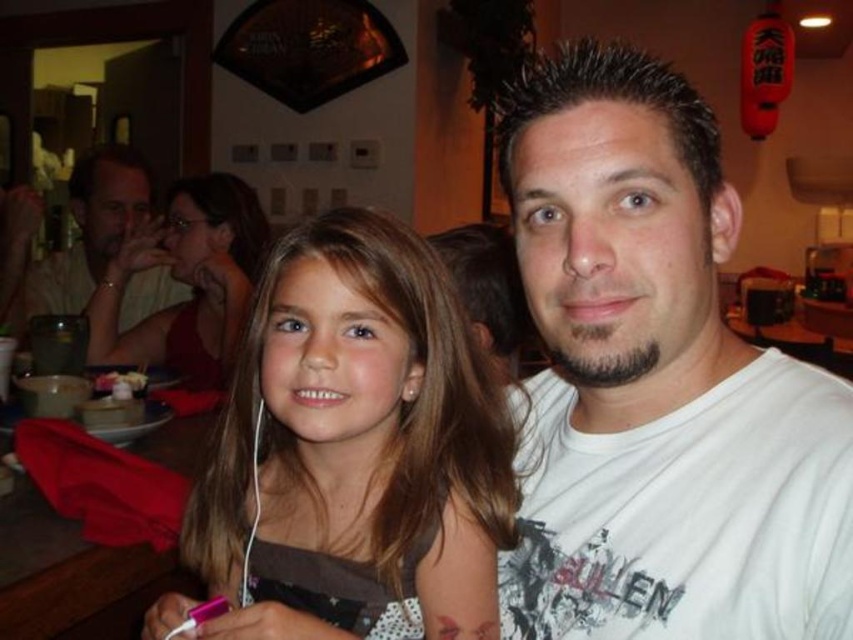
Question: Based on their relative distances, which object is nearer to the matte red dress at upper left?

Choices:
 (A) brown hair at center
 (B) matte white shirt at upper left
 (C) white cotton t-shirt at center

Answer: (B)

Question: Which object appears farthest from the camera in this image?

Choices:
 (A) matte white shirt at upper left
 (B) white cotton t-shirt at center

Answer: (A)

Question: Is white cotton t-shirt at center positioned at the back of matte white shirt at upper left?

Choices:
 (A) no
 (B) yes

Answer: (A)

Question: Is brown hair at center bigger than matte red dress at upper left?

Choices:
 (A) no
 (B) yes

Answer: (A)

Question: Does white cotton t-shirt at center appear under matte red dress at upper left?

Choices:
 (A) no
 (B) yes

Answer: (B)

Question: Based on their relative distances, which object is farther from the matte red dress at upper left?

Choices:
 (A) white cotton t-shirt at center
 (B) matte white shirt at upper left
 (C) brown hair at center

Answer: (A)